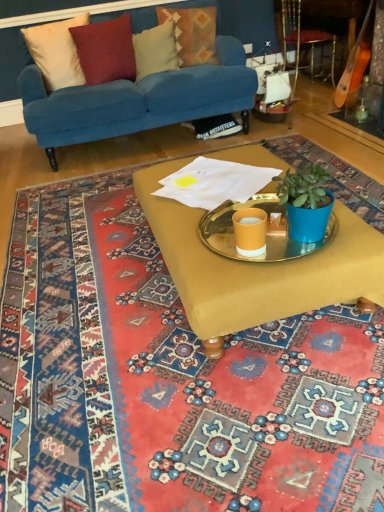
Measure the distance between velvet cushion at upper center, which is counted as the 2th pillow, starting from the right, and camera.

velvet cushion at upper center, which is counted as the 2th pillow, starting from the right, and camera are 3.02 meters apart.

Describe the element at coordinates (106, 50) in the screenshot. I see `velvet cushion at upper left, the third pillow positioned from the right` at that location.

In the scene shown: Measure the distance between point (109, 29) and camera.

They are 9.64 feet apart.

What do you see at coordinates (192, 34) in the screenshot? I see `textured woolen pillow at upper center, the first pillow viewed from the right` at bounding box center [192, 34].

Identify the location of textured woolen pillow at upper center, the fourth pillow when ordered from left to right. (192, 34).

Where is `velvet blue couch at upper center`? This screenshot has width=384, height=512. velvet blue couch at upper center is located at coordinates (137, 100).

In order to face carpeted rug at center, should I rotate leftwards or rightwards?

Rotate right and turn 4.030 degrees.

What do you see at coordinates (354, 67) in the screenshot? I see `wooden acoustic guitar at right` at bounding box center [354, 67].

Find the location of a particular element. The image size is (384, 512). matte gold coffee table at center is located at coordinates (257, 269).

You are a GUI agent. You are given a task and a screenshot of the screen. Output one action in this format:
    pyautogui.click(x=<x>, y=<y>)
    Task: Click on the velvet cushion at upper center, the 3th pillow from the left
    Image resolution: width=384 pixels, height=512 pixels.
    Given the screenshot: What is the action you would take?
    pyautogui.click(x=155, y=50)

In the scene shown: From the image's perspective, which object appears higher, carpeted rug at center or velvet cushion at upper left, the third pillow positioned from the right?

From the image's view, velvet cushion at upper left, the third pillow positioned from the right, is above.

Between carpeted rug at center and velvet cushion at upper left, which appears as the 2th pillow when viewed from the left, which one appears on the left side from the viewer's perspective?

velvet cushion at upper left, which appears as the 2th pillow when viewed from the left.

Considering their positions, is carpeted rug at center located in front of or behind velvet cushion at upper left, the third pillow positioned from the right?

carpeted rug at center is positioned closer to the viewer than velvet cushion at upper left, the third pillow positioned from the right.

Is carpeted rug at center facing away from velvet cushion at upper left, the third pillow positioned from the right?

No, carpeted rug at center is not facing the opposite direction of velvet cushion at upper left, the third pillow positioned from the right.

Which object is positioned more to the left, wooden acoustic guitar at right or velvet blue couch at upper center?

From the viewer's perspective, velvet blue couch at upper center appears more on the left side.

Is wooden acoustic guitar at right beside velvet blue couch at upper center?

No.

Is wooden acoustic guitar at right shorter than velvet blue couch at upper center?

Yes, wooden acoustic guitar at right is shorter than velvet blue couch at upper center.

Is textured woolen pillow at upper center, the first pillow viewed from the right, touching carpeted rug at center?

They are not placed beside each other.

Considering their positions, is textured woolen pillow at upper center, the fourth pillow when ordered from left to right, located in front of or behind carpeted rug at center?

Clearly, textured woolen pillow at upper center, the fourth pillow when ordered from left to right, is behind carpeted rug at center.

From a real-world perspective, which object rests below the other?

From a 3D spatial view, carpeted rug at center is below.

Considering the sizes of objects textured woolen pillow at upper center, the fourth pillow when ordered from left to right, and carpeted rug at center in the image provided, who is thinner, textured woolen pillow at upper center, the fourth pillow when ordered from left to right, or carpeted rug at center?

textured woolen pillow at upper center, the fourth pillow when ordered from left to right.

Who is more distant, velvet cushion at upper center, the 3th pillow from the left, or metallic gold armchair at upper right?

metallic gold armchair at upper right is behind.

Is velvet cushion at upper center, the 3th pillow from the left, shorter than metallic gold armchair at upper right?

Yes, velvet cushion at upper center, the 3th pillow from the left, is shorter than metallic gold armchair at upper right.

Considering the sizes of velvet cushion at upper center, which is counted as the 2th pillow, starting from the right, and metallic gold armchair at upper right in the image, is velvet cushion at upper center, which is counted as the 2th pillow, starting from the right, bigger or smaller than metallic gold armchair at upper right?

Considering their sizes, velvet cushion at upper center, which is counted as the 2th pillow, starting from the right, takes up less space than metallic gold armchair at upper right.

Is velvet blue couch at upper center completely or partially inside metallic tray at center?

That's incorrect, velvet blue couch at upper center is not inside metallic tray at center.

Which is more to the left, metallic tray at center or velvet blue couch at upper center?

velvet blue couch at upper center.

Is there a large distance between metallic tray at center and velvet blue couch at upper center?

metallic tray at center is far away from velvet blue couch at upper center.

Is metallic tray at center taller than velvet blue couch at upper center?

No, metallic tray at center is not taller than velvet blue couch at upper center.

Can you tell me how much carpeted rug at center and metallic tray at center differ in facing direction?

The angle between the facing direction of carpeted rug at center and the facing direction of metallic tray at center is 179 degrees.

Are carpeted rug at center and metallic tray at center far apart?

No, carpeted rug at center is not far away from metallic tray at center.

From the image's perspective, is carpeted rug at center positioned above or below metallic tray at center?

Clearly, from the image's perspective, carpeted rug at center is below metallic tray at center.

The height and width of the screenshot is (512, 384). What are the coordinates of `mat in front of the metallic tray at center` in the screenshot? It's located at (169, 379).

Could you measure the distance between velvet cushion at upper left, which is the first pillow from left to right, and metallic gold armchair at upper right?

The distance of velvet cushion at upper left, which is the first pillow from left to right, from metallic gold armchair at upper right is 2.01 meters.

This screenshot has height=512, width=384. What are the coordinates of `pillow that is the 3rd object above the metallic gold armchair at upper right (from a real-world perspective)` in the screenshot? It's located at (56, 52).

How different are the orientations of velvet cushion at upper left, which is the fourth pillow from right to left, and metallic gold armchair at upper right in degrees?

75.1 degrees.

Consider the image. Between velvet cushion at upper left, which is the fourth pillow from right to left, and metallic gold armchair at upper right, which one has larger width?

metallic gold armchair at upper right is wider.

The image size is (384, 512). I want to click on the 3rd pillow to the left of the carpeted rug at center, starting your count from the anchor, so click(x=106, y=50).

The width and height of the screenshot is (384, 512). Find the location of `instrument behind the velvet blue couch at upper center`. instrument behind the velvet blue couch at upper center is located at coordinates (354, 67).

Looking at the image, which one is located closer to metallic tray at center, textured woolen pillow at upper center, the fourth pillow when ordered from left to right, or matte gold coffee table at center?

The object closer to metallic tray at center is matte gold coffee table at center.

Considering their positions, is wooden acoustic guitar at right positioned closer to carpeted rug at center than metallic gold armchair at upper right?

The object closer to carpeted rug at center is wooden acoustic guitar at right.

Based on their spatial positions, is wooden acoustic guitar at right or velvet cushion at upper left, which is the fourth pillow from right to left, further from textured woolen pillow at upper center, the fourth pillow when ordered from left to right?

wooden acoustic guitar at right is further to textured woolen pillow at upper center, the fourth pillow when ordered from left to right.

Based on their spatial positions, is velvet cushion at upper left, which appears as the 2th pillow when viewed from the left, or matte gold coffee table at center closer to velvet cushion at upper left, which is the fourth pillow from right to left?

velvet cushion at upper left, which appears as the 2th pillow when viewed from the left, is closer to velvet cushion at upper left, which is the fourth pillow from right to left.

Which object lies nearer to the anchor point velvet cushion at upper center, which is counted as the 2th pillow, starting from the right, wooden acoustic guitar at right or velvet blue couch at upper center?

velvet blue couch at upper center is closer to velvet cushion at upper center, which is counted as the 2th pillow, starting from the right.

When comparing their distances from carpeted rug at center, does velvet cushion at upper left, which is the fourth pillow from right to left, or velvet blue couch at upper center seem closer?

velvet blue couch at upper center is positioned closer to the anchor carpeted rug at center.

Looking at the image, which one is located closer to textured woolen pillow at upper center, the fourth pillow when ordered from left to right, matte gold coffee table at center or velvet cushion at upper left, which is the fourth pillow from right to left?

velvet cushion at upper left, which is the fourth pillow from right to left, is closer to textured woolen pillow at upper center, the fourth pillow when ordered from left to right.

When comparing their distances from velvet blue couch at upper center, does wooden acoustic guitar at right or carpeted rug at center seem further?

carpeted rug at center.

At what (x,y) coordinates should I click in order to perform the action: click on studio couch between matte gold coffee table at center and velvet cushion at upper center, the 3th pillow from the left, in the front-back direction. Please return your answer as a coordinate pair (x, y). The width and height of the screenshot is (384, 512). Looking at the image, I should click on (137, 100).

Locate an element on the screen. studio couch positioned between carpeted rug at center and velvet cushion at upper left, which is the fourth pillow from right to left, from near to far is located at coordinates (137, 100).

At what (x,y) coordinates should I click in order to perform the action: click on coffee table positioned between carpeted rug at center and wooden acoustic guitar at right from near to far. Please return your answer as a coordinate pair (x, y). This screenshot has width=384, height=512. Looking at the image, I should click on (257, 269).

The height and width of the screenshot is (512, 384). What are the coordinates of `round table positioned between matte gold coffee table at center and velvet cushion at upper center, which is counted as the 2th pillow, starting from the right, from near to far` in the screenshot? It's located at (266, 231).